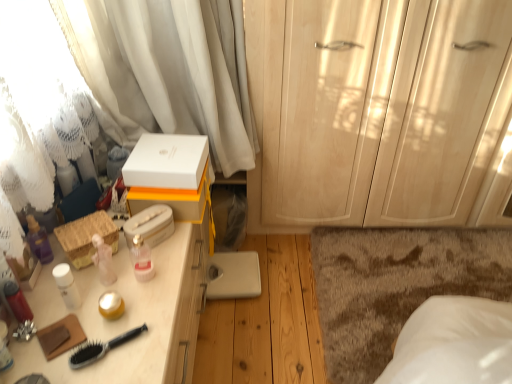
Image resolution: width=512 pixels, height=384 pixels. What are the coordinates of `free space to the left of pink glossy bottle at center, which is counted as the 2th toiletry, starting from the front` in the screenshot? It's located at (96, 279).